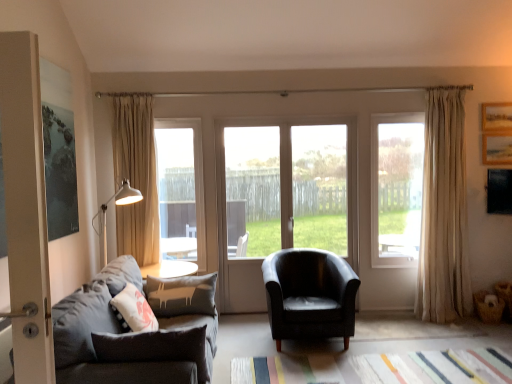
This screenshot has width=512, height=384. I want to click on clear glass window at center, the 3th window from the left, so click(396, 187).

This screenshot has width=512, height=384. In order to click on clear glass door at center, which is counted as the third window, starting from the right in this screenshot , I will do `click(181, 187)`.

What is the approximate height of beige fabric curtain at left, acting as the 1th curtain starting from the left?

beige fabric curtain at left, acting as the 1th curtain starting from the left, is 1.77 meters tall.

What do you see at coordinates (497, 148) in the screenshot?
I see `wooden picture frame at upper right` at bounding box center [497, 148].

In order to face black leather armchair at center, should I rotate leftwards or rightwards?

A 7.039 degree turn to the right will do.

What do you see at coordinates (443, 211) in the screenshot? Image resolution: width=512 pixels, height=384 pixels. I see `beige fabric curtain at right, which is the first curtain in right-to-left order` at bounding box center [443, 211].

This screenshot has height=384, width=512. I want to click on beige fabric curtain at right, which is the first curtain in right-to-left order, so click(443, 211).

In order to click on clear glass window at center, the 3th window from the left in this screenshot , I will do `click(396, 187)`.

How different are the orientations of beige fabric curtain at right, which is the first curtain in right-to-left order, and transparent glass door at center, which is the 2th window from left to right, in degrees?

The angular difference between beige fabric curtain at right, which is the first curtain in right-to-left order, and transparent glass door at center, which is the 2th window from left to right, is 0.515 degrees.

You are a GUI agent. You are given a task and a screenshot of the screen. Output one action in this format:
    pyautogui.click(x=<x>, y=<y>)
    Task: Click on the curtain located on the right of transparent glass door at center, which is the 2th window from left to right
    
    Given the screenshot: What is the action you would take?
    pyautogui.click(x=443, y=211)

Between beige fabric curtain at right, which is the first curtain in right-to-left order, and transparent glass door at center, which is the 2th window from left to right, which one appears on the left side from the viewer's perspective?

From the viewer's perspective, transparent glass door at center, which is the 2th window from left to right, appears more on the left side.

Considering the relative sizes of beige fabric curtain at right, which is the first curtain in right-to-left order, and transparent glass door at center, which ranks as the second window in right-to-left order, in the image provided, is beige fabric curtain at right, which is the first curtain in right-to-left order, wider than transparent glass door at center, which ranks as the second window in right-to-left order,?

Yes, beige fabric curtain at right, which is the first curtain in right-to-left order, is wider than transparent glass door at center, which ranks as the second window in right-to-left order.

Can you tell me how much transparent glass door at center, which is the 2th window from left to right, and wooden picture frame at upper right differ in facing direction?

They differ by 0.515 degrees in their facing directions.

Is transparent glass door at center, which ranks as the second window in right-to-left order, next to wooden picture frame at upper right?

No, transparent glass door at center, which ranks as the second window in right-to-left order, is not with wooden picture frame at upper right.

Which of these two, transparent glass door at center, which is the 2th window from left to right, or wooden picture frame at upper right, is bigger?

transparent glass door at center, which is the 2th window from left to right, is bigger.

From a real-world perspective, is transparent glass door at center, which is the 2th window from left to right, on wooden picture frame at upper right?

Actually, transparent glass door at center, which is the 2th window from left to right, is physically below wooden picture frame at upper right in the real world.

Between beige fabric curtain at left, marked as the second curtain in a right-to-left arrangement, and clear glass window at center, which is the 1th window from right to left, which one appears on the right side from the viewer's perspective?

clear glass window at center, which is the 1th window from right to left, is more to the right.

From a real-world perspective, does beige fabric curtain at left, acting as the 1th curtain starting from the left, sit lower than clear glass window at center, which is the 1th window from right to left?

No, from a real-world perspective, beige fabric curtain at left, acting as the 1th curtain starting from the left, is not under clear glass window at center, which is the 1th window from right to left.

From the picture: Is beige fabric curtain at left, acting as the 1th curtain starting from the left, oriented away from clear glass window at center, which is the 1th window from right to left?

No, beige fabric curtain at left, acting as the 1th curtain starting from the left, is not facing away from clear glass window at center, which is the 1th window from right to left.

Which object is wider, beige fabric curtain at left, marked as the second curtain in a right-to-left arrangement, or clear glass window at center, the 3th window from the left?

beige fabric curtain at left, marked as the second curtain in a right-to-left arrangement, is wider.

Locate an element on the screen. The height and width of the screenshot is (384, 512). chair that appears on the right of clear glass door at center, which is counted as the third window, starting from the right is located at coordinates (310, 295).

Which object is further away from the camera taking this photo, black leather armchair at center or clear glass door at center, positioned as the first window in left-to-right order?

clear glass door at center, positioned as the first window in left-to-right order, is further from the camera.

From a real-world perspective, is black leather armchair at center beneath clear glass door at center, which is counted as the third window, starting from the right?

Correct, in the physical world, black leather armchair at center is lower than clear glass door at center, which is counted as the third window, starting from the right.

Considering the sizes of black leather armchair at center and clear glass door at center, positioned as the first window in left-to-right order, in the image, is black leather armchair at center wider or thinner than clear glass door at center, positioned as the first window in left-to-right order,?

Clearly, black leather armchair at center has more width compared to clear glass door at center, positioned as the first window in left-to-right order.

How many degrees apart are the facing directions of black leather armchair at center and wooden picture frame at upper right?

0.0197 degrees.

From the picture: Could you tell me if black leather armchair at center is facing wooden picture frame at upper right?

No, black leather armchair at center is not oriented towards wooden picture frame at upper right.

Would you say black leather armchair at center is inside or outside wooden picture frame at upper right?

black leather armchair at center is located beyond the bounds of wooden picture frame at upper right.

Identify the location of picture frame to the right of black leather armchair at center. (497, 148).

Image resolution: width=512 pixels, height=384 pixels. In order to click on curtain on the left side of dark gray fabric couch at left in this screenshot , I will do `click(136, 177)`.

Can you tell me how much dark gray fabric couch at left and beige fabric curtain at left, acting as the 1th curtain starting from the left, differ in facing direction?

The facing directions of dark gray fabric couch at left and beige fabric curtain at left, acting as the 1th curtain starting from the left, are 92.6 degrees apart.

Who is shorter, dark gray fabric couch at left or beige fabric curtain at left, marked as the second curtain in a right-to-left arrangement?

Standing shorter between the two is dark gray fabric couch at left.

Is dark gray fabric couch at left closer to camera compared to beige fabric curtain at left, marked as the second curtain in a right-to-left arrangement?

Yes, it is in front of beige fabric curtain at left, marked as the second curtain in a right-to-left arrangement.

Can you confirm if dark gray fabric couch at left is shorter than clear glass window at center, which is the 1th window from right to left?

Indeed, dark gray fabric couch at left has a lesser height compared to clear glass window at center, which is the 1th window from right to left.

From the image's perspective, which one is positioned higher, dark gray fabric couch at left or clear glass window at center, which is the 1th window from right to left?

clear glass window at center, which is the 1th window from right to left, from the image's perspective.

Can you confirm if dark gray fabric couch at left is smaller than clear glass window at center, the 3th window from the left?

No, dark gray fabric couch at left is not smaller than clear glass window at center, the 3th window from the left.

Identify the location of curtain on the right of transparent glass door at center, which is the 2th window from left to right. The image size is (512, 384). (443, 211).

Locate an element on the screen. the 3rd window positioned below the wooden picture frame at upper right (from the image's perspective) is located at coordinates (289, 187).

Which object lies nearer to the anchor point clear glass window at center, which is the 1th window from right to left, beige fabric curtain at right, acting as the second curtain starting from the left, or dark gray fabric couch at left?

beige fabric curtain at right, acting as the second curtain starting from the left, is closer to clear glass window at center, which is the 1th window from right to left.

Based on their spatial positions, is transparent glass door at center, which is the 2th window from left to right, or clear glass door at center, which is counted as the third window, starting from the right, closer to dark gray fabric couch at left?

Based on the image, transparent glass door at center, which is the 2th window from left to right, appears to be nearer to dark gray fabric couch at left.

Looking at the image, which one is located further to clear glass window at center, the 3th window from the left, dark gray fabric couch at left or transparent glass door at center, which ranks as the second window in right-to-left order?

The object further to clear glass window at center, the 3th window from the left, is dark gray fabric couch at left.

From the image, which object appears to be nearer to beige fabric curtain at right, which is the first curtain in right-to-left order, dark gray fabric couch at left or wooden picture frame at upper right?

wooden picture frame at upper right lies closer to beige fabric curtain at right, which is the first curtain in right-to-left order, than the other object.

Based on their spatial positions, is beige fabric curtain at right, acting as the second curtain starting from the left, or black leather armchair at center closer to clear glass window at center, which is the 1th window from right to left?

beige fabric curtain at right, acting as the second curtain starting from the left, is positioned closer to the anchor clear glass window at center, which is the 1th window from right to left.

When comparing their distances from dark gray fabric couch at left, does wooden picture frame at upper right or clear glass window at center, which is the 1th window from right to left, seem further?

Based on the image, wooden picture frame at upper right appears to be further to dark gray fabric couch at left.

Looking at the image, which one is located further to beige fabric curtain at left, acting as the 1th curtain starting from the left, beige fabric curtain at right, acting as the second curtain starting from the left, or wooden picture frame at upper right?

wooden picture frame at upper right is positioned further to the anchor beige fabric curtain at left, acting as the 1th curtain starting from the left.

From the image, which object appears to be farther from black leather armchair at center, clear glass door at center, positioned as the first window in left-to-right order, or dark gray fabric couch at left?

clear glass door at center, positioned as the first window in left-to-right order, is further to black leather armchair at center.

Find the location of a particular element. Image resolution: width=512 pixels, height=384 pixels. studio couch between beige fabric curtain at left, marked as the second curtain in a right-to-left arrangement, and wooden picture frame at upper right is located at coordinates (136, 333).

Locate an element on the screen. The image size is (512, 384). chair between dark gray fabric couch at left and transparent glass door at center, which is the 2th window from left to right, along the z-axis is located at coordinates (310, 295).

I want to click on curtain between clear glass window at center, which is the 1th window from right to left, and wooden picture frame at upper right from left to right, so click(x=443, y=211).

Locate an element on the screen. The width and height of the screenshot is (512, 384). window between clear glass door at center, positioned as the first window in left-to-right order, and clear glass window at center, which is the 1th window from right to left is located at coordinates (289, 187).